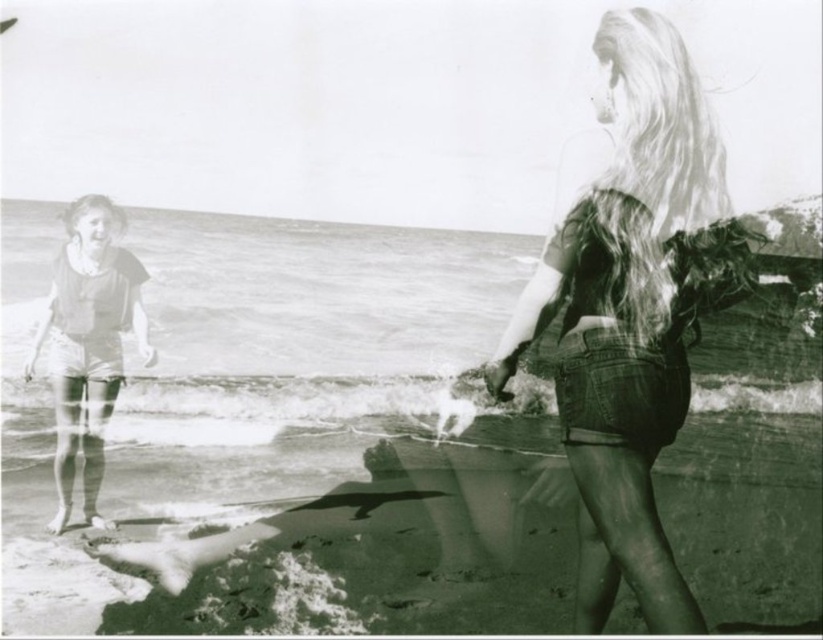
You are standing at the point marked by the coordinates point (379, 548). Looking around the beach scene, which object from the list is exactly at your current location?

The smooth sand at lower center is located at point (379, 548), so the object at your current location is the smooth sand at lower center.

You are a photographer trying to capture a shot of the smooth sand at lower center and the denim shorts at center. Which object appears smaller in the photo?

The smooth sand at lower center appears smaller than the denim shorts at center in the photo.